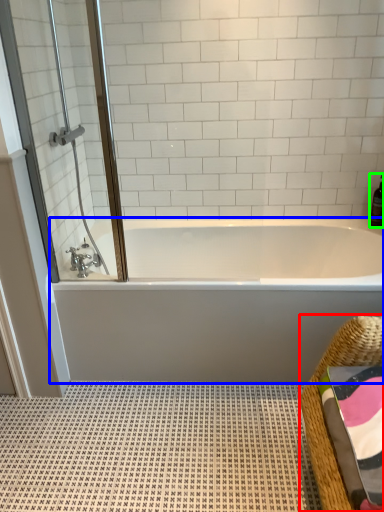
Question: Based on their relative distances, which object is farther from basket (highlighted by a red box)? Choose from bathtub (highlighted by a blue box) and bottle (highlighted by a green box).

Choices:
 (A) bathtub
 (B) bottle

Answer: (B)